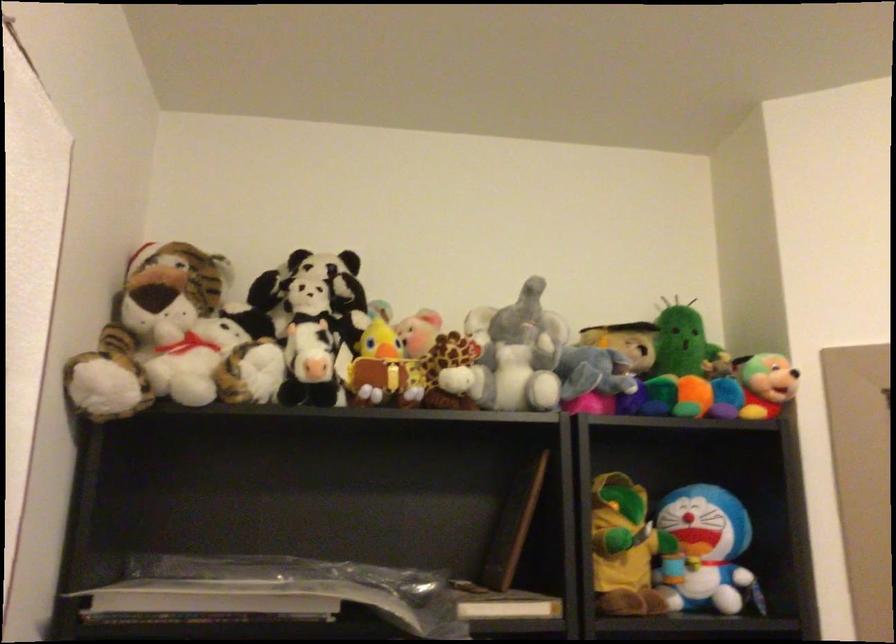
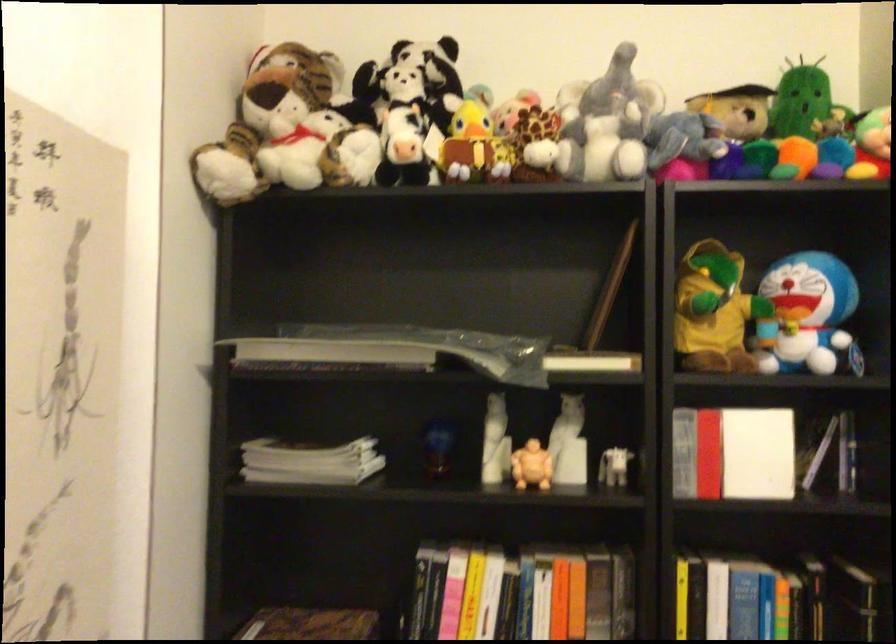
Where in the second image is the point corresponding to (x=627, y=547) from the first image?

(713, 310)